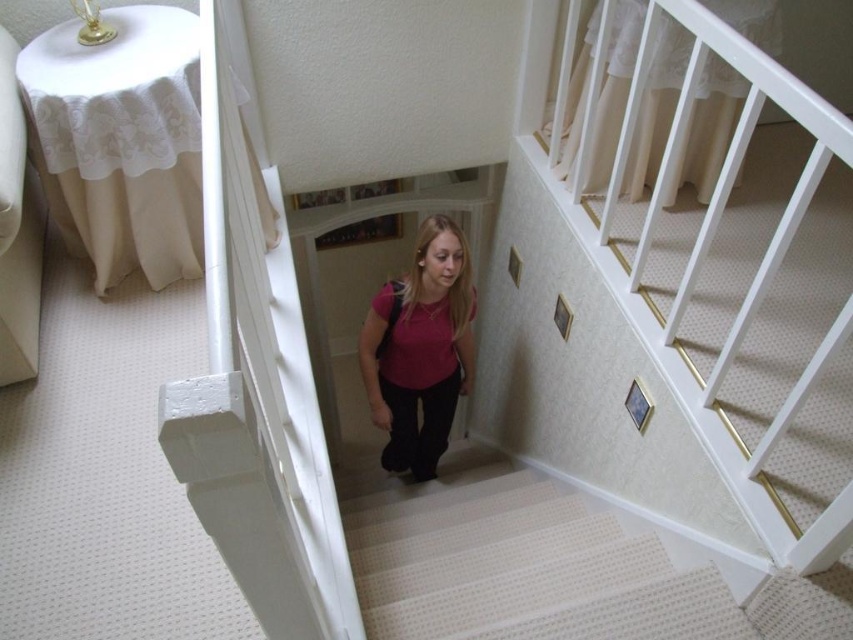
Question: Which object is farther from the camera taking this photo?

Choices:
 (A) matte pink shirt at center
 (B) white textured carpet at center

Answer: (A)

Question: Is white textured carpet at center smaller than matte pink shirt at center?

Choices:
 (A) no
 (B) yes

Answer: (A)

Question: Which of the following is the closest to the observer?

Choices:
 (A) white textured carpet at center
 (B) matte pink shirt at center

Answer: (A)

Question: Which point appears closest to the camera in this image?

Choices:
 (A) (567, 579)
 (B) (387, 467)

Answer: (A)

Question: Is white textured carpet at center to the right of matte pink shirt at center from the viewer's perspective?

Choices:
 (A) yes
 (B) no

Answer: (A)

Question: Can you confirm if white textured carpet at center is wider than matte pink shirt at center?

Choices:
 (A) yes
 (B) no

Answer: (A)